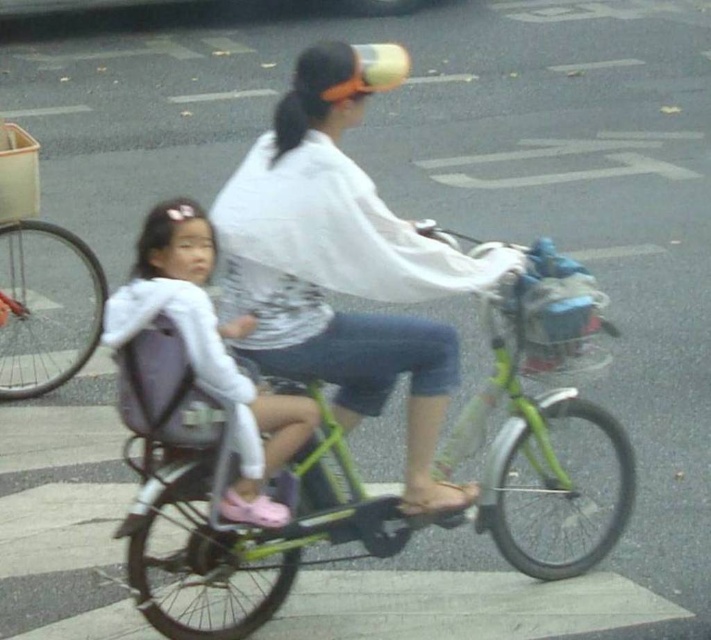
Question: Is green matte bicycle at center positioned before white matte shirt at center?

Choices:
 (A) yes
 (B) no

Answer: (A)

Question: Based on their relative distances, which object is farther from the white matte jacket at center?

Choices:
 (A) green matte bicycle at center
 (B) white matte shirt at center

Answer: (A)

Question: Does white matte shirt at center have a lesser width compared to white matte jacket at center?

Choices:
 (A) no
 (B) yes

Answer: (A)

Question: Which is farther from the white matte shirt at center?

Choices:
 (A) white matte jacket at center
 (B) green matte bicycle at center

Answer: (A)

Question: Can you confirm if green matte bicycle at center is positioned to the left of white matte shirt at center?

Choices:
 (A) no
 (B) yes

Answer: (A)

Question: Which object appears closest to the camera in this image?

Choices:
 (A) green matte bicycle at center
 (B) white matte jacket at center

Answer: (B)